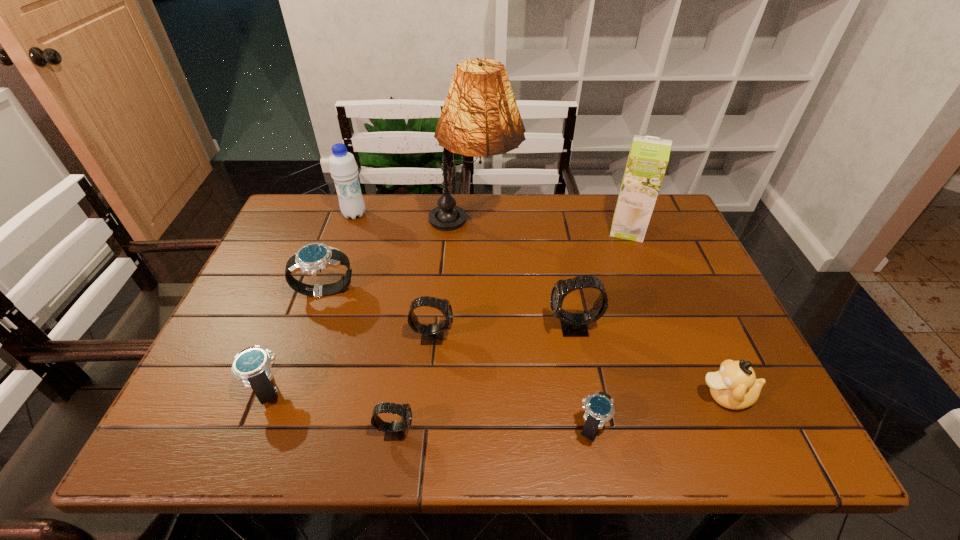
At what (x,y) coordinates should I click in order to perform the action: click on soya milk present at the far edge. Please return your answer as a coordinate pair (x, y). Looking at the image, I should click on (648, 158).

Locate an element on the screen. water bottle present at the far edge is located at coordinates (343, 168).

Identify the location of duckling present at the near edge. (734, 386).

The height and width of the screenshot is (540, 960). Identify the location of soya milk located at the right edge. (648, 158).

I want to click on duckling at the right edge, so click(734, 386).

Where is `object that is positioned at the near left corner`? The image size is (960, 540). object that is positioned at the near left corner is located at coordinates (252, 365).

You are a GUI agent. You are given a task and a screenshot of the screen. Output one action in this format:
    pyautogui.click(x=<x>, y=<y>)
    Task: Click on the object present at the far right corner
    This screenshot has height=540, width=960.
    Given the screenshot: What is the action you would take?
    click(x=648, y=158)

Find the location of a particular element. The width and height of the screenshot is (960, 540). object located in the near right corner section of the desktop is located at coordinates 734,386.

Identify the location of free space at the far edge. The width and height of the screenshot is (960, 540). (341, 219).

In the image, there is a desktop. Where is `free space at the near edge`? The image size is (960, 540). free space at the near edge is located at coordinates (350, 431).